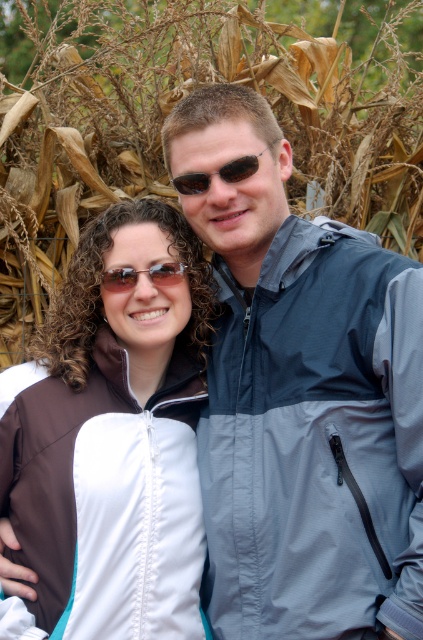
Is brown textured corn at upper center bigger than brown textured sunglasses at center?

Yes, brown textured corn at upper center is bigger than brown textured sunglasses at center.

This screenshot has height=640, width=423. What do you see at coordinates (170, 108) in the screenshot?
I see `brown textured corn at upper center` at bounding box center [170, 108].

What do you see at coordinates (170, 108) in the screenshot? I see `brown textured corn at upper center` at bounding box center [170, 108].

Where is `brown textured corn at upper center`? The width and height of the screenshot is (423, 640). brown textured corn at upper center is located at coordinates (170, 108).

Is matte blue jacket at center closer to camera compared to white matte jacket at center?

Yes, matte blue jacket at center is closer to the viewer.

Is point (392, 429) positioned before point (76, 618)?

No, it is not.

Which is in front, point (271, 115) or point (139, 433)?

Point (139, 433) is in front.

Where is `matte blue jacket at center`? This screenshot has width=423, height=640. matte blue jacket at center is located at coordinates (302, 397).

Does matte blue jacket at center appear on the right side of brown textured sunglasses at center?

Yes, matte blue jacket at center is to the right of brown textured sunglasses at center.

Is matte blue jacket at center bigger than brown textured sunglasses at center?

Yes.

At what (x,y) coordinates should I click in order to perform the action: click on matte blue jacket at center. Please return your answer as a coordinate pair (x, y). Looking at the image, I should click on (302, 397).

The width and height of the screenshot is (423, 640). Identify the location of matte blue jacket at center. (302, 397).